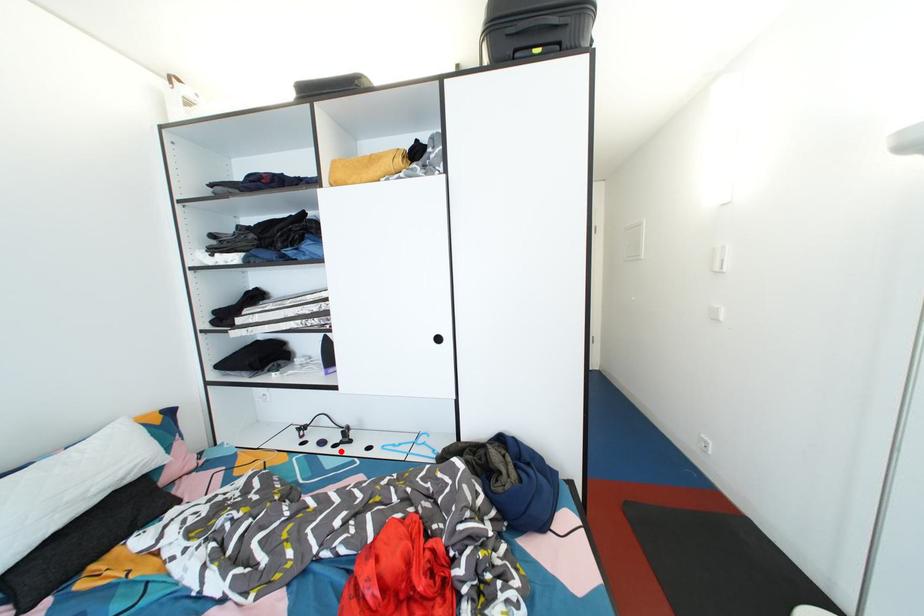
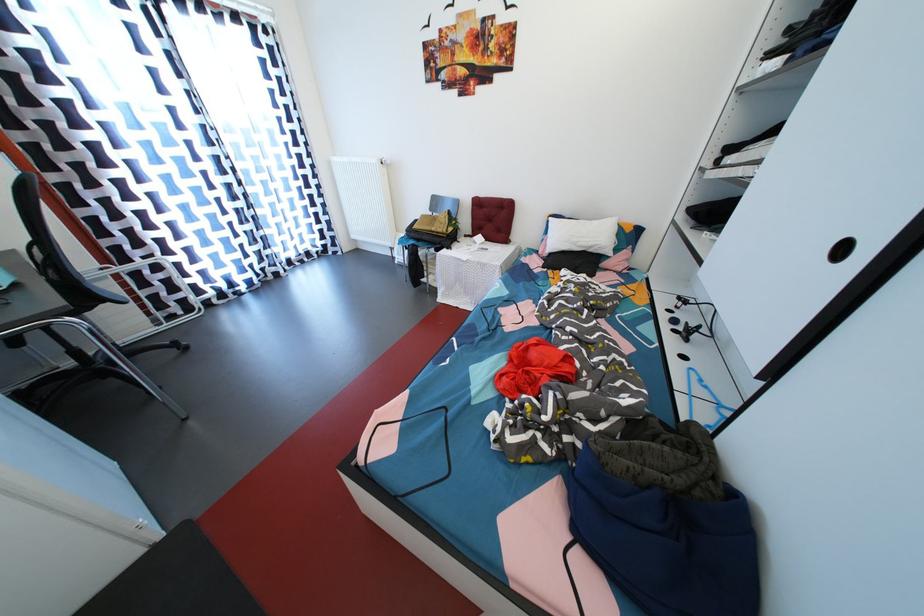
Where in the second image is the point corresponding to the highlighted location from the first image?

(681, 336)